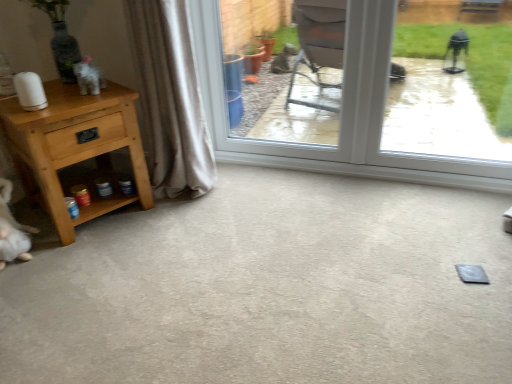
Locate an element on the screen. The height and width of the screenshot is (384, 512). free space that is to the left of white glossy elephant at upper left is located at coordinates (61, 94).